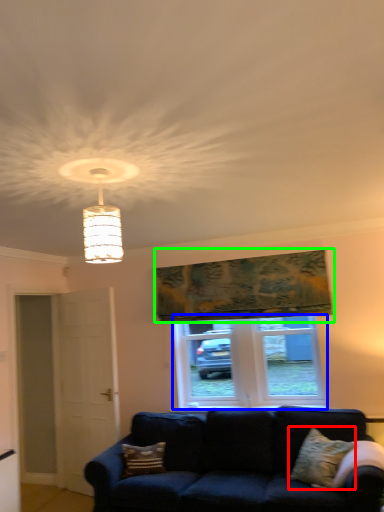
Question: Which is nearer to the pillow (highlighted by a red box)? window (highlighted by a blue box) or tapestry (highlighted by a green box).

Choices:
 (A) window
 (B) tapestry

Answer: (A)